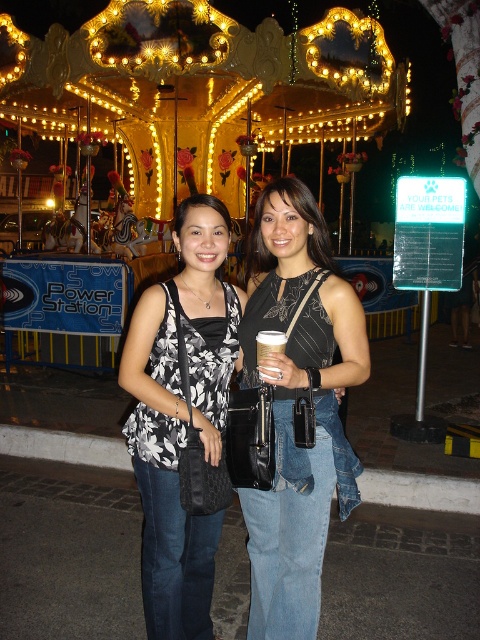
Question: Can you confirm if gold metallic carousel at upper center is wider than black printed tank top at center?

Choices:
 (A) yes
 (B) no

Answer: (A)

Question: Among these points, which one is farthest from the camera?

Choices:
 (A) (266, 248)
 (B) (331, 436)
 (C) (257, 339)

Answer: (A)

Question: Which object is the closest to the black textured dress at center?

Choices:
 (A) gold metallic carousel at upper center
 (B) matte black dress at center

Answer: (B)

Question: Is gold metallic carousel at upper center to the right of matte black dress at center from the viewer's perspective?

Choices:
 (A) yes
 (B) no

Answer: (B)

Question: Is gold metallic carousel at upper center smaller than white paper cup at center?

Choices:
 (A) yes
 (B) no

Answer: (B)

Question: Which point is farther to the camera?

Choices:
 (A) (172, 444)
 (B) (200, 35)
 (C) (273, 188)

Answer: (B)